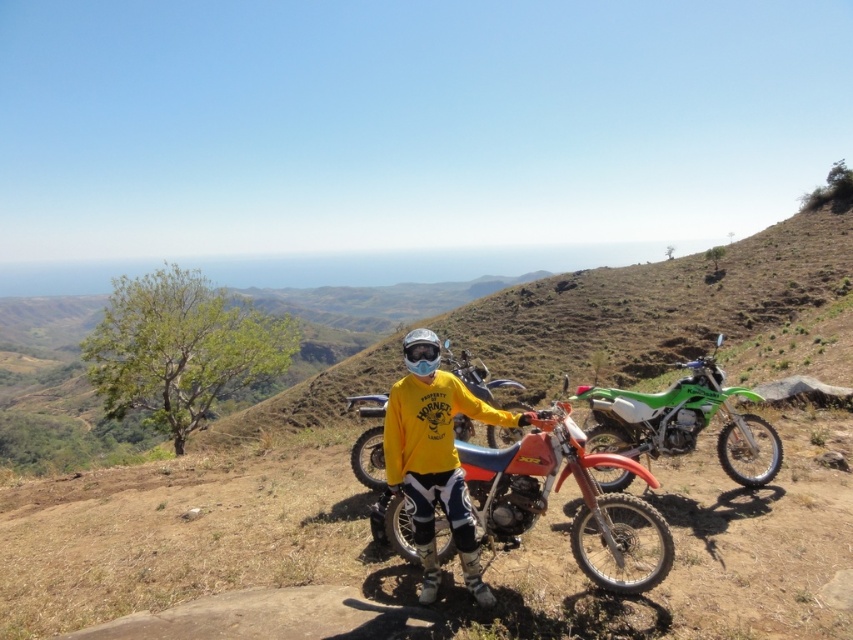
You are a photographer trying to capture a photo of the green matte dirt bike at center. You want to place it in the lower third of the frame. Based on its current position, is it already positioned there?

The green matte dirt bike at center is at point (682, 420). Since the lower third of the frame is between 0.666 and 1.0 on the y coordinate, the bike is just above that threshold. To position it in the lower third, you would need to move it slightly downward.

You are a photographer trying to capture a clear shot of both the green matte dirt bike at center and the glossy white helmet at center. Based on their positions, which object is closer to the camera?

The green matte dirt bike at center is positioned under the glossy white helmet at center, so the helmet is closer to the camera.